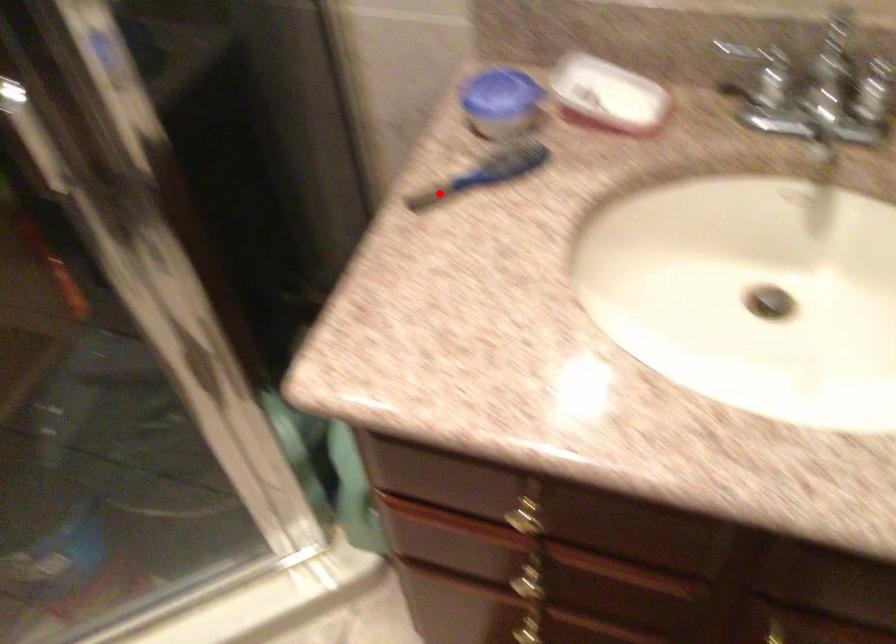
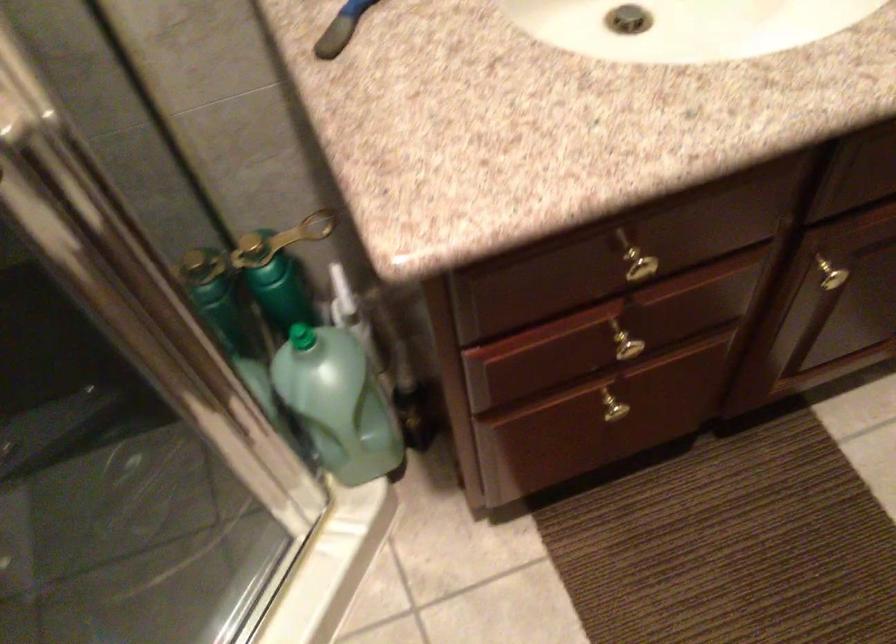
Question: I am providing you with two images of the same scene from different viewpoints. Image1 has a red point marked. In image2, the corresponding 3D location appears at what relative position? Reply with the corresponding letter.

Choices:
 (A) Closer
 (B) Farther

Answer: (A)